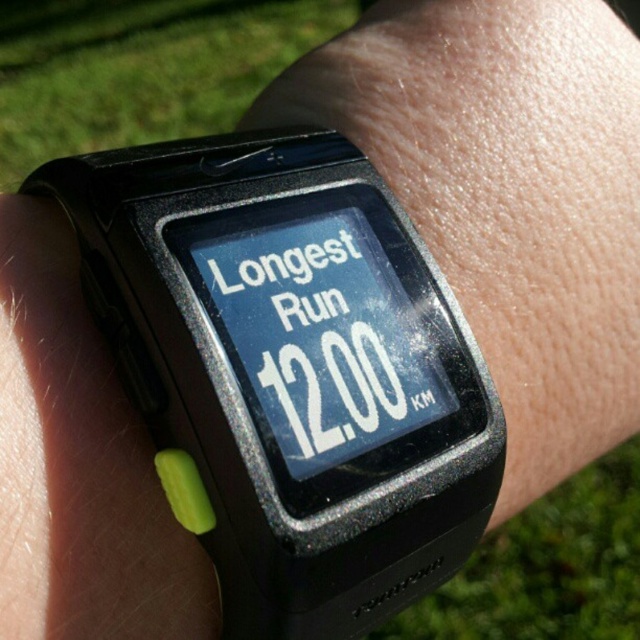
Question: In this image, where is black plastic watch at center located relative to black rubber watch at center?

Choices:
 (A) right
 (B) left

Answer: (B)

Question: Can you confirm if black plastic watch at center is positioned below black rubber watch at center?

Choices:
 (A) no
 (B) yes

Answer: (B)

Question: Which of the following is the closest to the observer?

Choices:
 (A) black rubber watch at center
 (B) black plastic watch at center

Answer: (B)

Question: In this image, where is black plastic watch at center located relative to black rubber watch at center?

Choices:
 (A) below
 (B) above

Answer: (A)